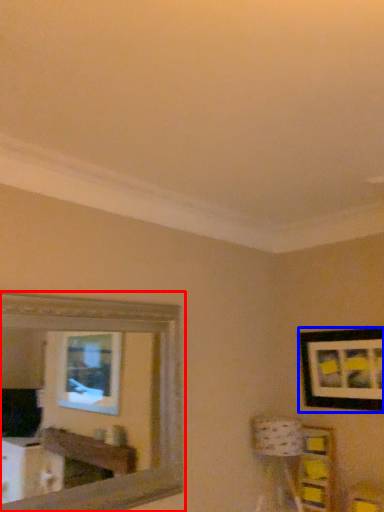
Question: Which object is closer to the camera taking this photo, mirror (highlighted by a red box) or picture frame (highlighted by a blue box)?

Choices:
 (A) mirror
 (B) picture frame

Answer: (A)